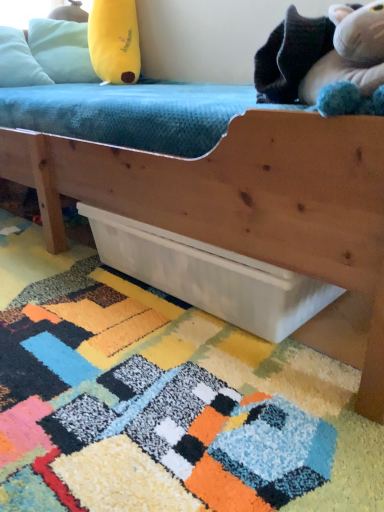
Question: Is light blue fabric pillow at upper left far away from white matte drawer at lower center?

Choices:
 (A) no
 (B) yes

Answer: (B)

Question: Is light blue fabric pillow at upper left to the left of white matte drawer at lower center from the viewer's perspective?

Choices:
 (A) no
 (B) yes

Answer: (B)

Question: Is light blue fabric pillow at upper left surrounding white matte drawer at lower center?

Choices:
 (A) no
 (B) yes

Answer: (A)

Question: Is light blue fabric pillow at upper left facing away from white matte drawer at lower center?

Choices:
 (A) yes
 (B) no

Answer: (B)

Question: Is light blue fabric pillow at upper left smaller than white matte drawer at lower center?

Choices:
 (A) no
 (B) yes

Answer: (B)

Question: Does light blue fabric pillow at upper left lie in front of white matte drawer at lower center?

Choices:
 (A) yes
 (B) no

Answer: (B)

Question: Considering the relative sizes of yellow plush toy at upper left, positioned as the 1th toy in back-to-front order, and fluffy white stuffed animal at upper right, arranged as the 1th toy when viewed from the front, in the image provided, is yellow plush toy at upper left, positioned as the 1th toy in back-to-front order, wider than fluffy white stuffed animal at upper right, arranged as the 1th toy when viewed from the front,?

Choices:
 (A) no
 (B) yes

Answer: (B)

Question: Is yellow plush toy at upper left, the first toy viewed from the left, positioned far away from fluffy white stuffed animal at upper right, which is the second toy from back to front?

Choices:
 (A) no
 (B) yes

Answer: (B)

Question: Considering the relative positions of yellow plush toy at upper left, positioned as the 1th toy in back-to-front order, and fluffy white stuffed animal at upper right, which appears as the 2th toy when viewed from the top, in the image provided, is yellow plush toy at upper left, positioned as the 1th toy in back-to-front order, to the right of fluffy white stuffed animal at upper right, which appears as the 2th toy when viewed from the top, from the viewer's perspective?

Choices:
 (A) no
 (B) yes

Answer: (A)

Question: Is yellow plush toy at upper left, positioned as the 1th toy in back-to-front order, to the left of fluffy white stuffed animal at upper right, which is the 1th toy from bottom to top, from the viewer's perspective?

Choices:
 (A) yes
 (B) no

Answer: (A)

Question: Is yellow plush toy at upper left, positioned as the 1th toy in back-to-front order, facing away from fluffy white stuffed animal at upper right, arranged as the 1th toy when viewed from the front?

Choices:
 (A) yes
 (B) no

Answer: (B)

Question: Does yellow plush toy at upper left, the first toy viewed from the left, come behind fluffy white stuffed animal at upper right, which appears as the 2th toy when viewed from the top?

Choices:
 (A) yes
 (B) no

Answer: (A)

Question: Is there a large distance between fluffy white stuffed animal at upper right, arranged as the first toy when viewed from the right, and multicolored shaggy rug at lower center?

Choices:
 (A) yes
 (B) no

Answer: (B)